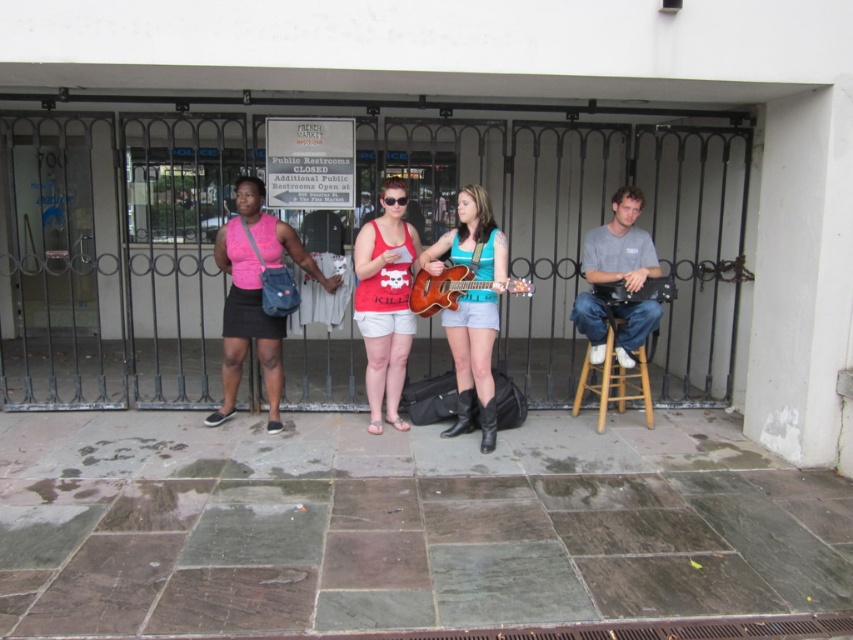
Is point (490, 346) positioned behind point (378, 371)?

No, it is not.

Does matte blue denim shorts at center have a greater width compared to matte red tank top at center?

Correct, the width of matte blue denim shorts at center exceeds that of matte red tank top at center.

Between point (496, 332) and point (389, 260), which one is positioned in front?

Positioned in front is point (496, 332).

Find the location of a particular element. The height and width of the screenshot is (640, 853). matte blue denim shorts at center is located at coordinates (473, 307).

Can you confirm if wooden stool at right is positioned to the left of wooden acoustic guitar at center?

No, wooden stool at right is not to the left of wooden acoustic guitar at center.

In order to click on wooden stool at right in this screenshot , I will do `click(614, 378)`.

Can you confirm if pink fabric skirt at center is taller than gray cotton shirt at center?

Indeed, pink fabric skirt at center has a greater height compared to gray cotton shirt at center.

Who is shorter, pink fabric skirt at center or gray cotton shirt at center?

gray cotton shirt at center is shorter.

Who is more forward, (279, 344) or (619, 278)?

Point (619, 278) is in front.

At what (x,y) coordinates should I click in order to perform the action: click on pink fabric skirt at center. Please return your answer as a coordinate pair (x, y). Looking at the image, I should click on (254, 296).